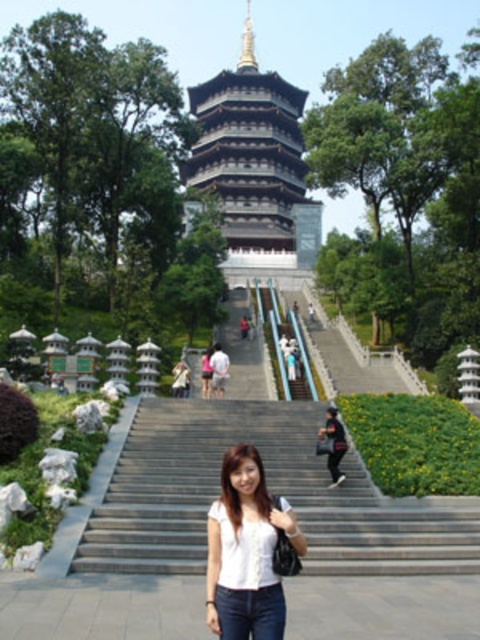
Question: Observing the image, what is the correct spatial positioning of gray concrete stairs at center in reference to white stone pagoda at center?

Choices:
 (A) below
 (B) above

Answer: (A)

Question: From the image, what is the correct spatial relationship of gray concrete stairs at center in relation to white matte shirt at center?

Choices:
 (A) below
 (B) above

Answer: (A)

Question: Which object is closer to the camera taking this photo?

Choices:
 (A) gray concrete stairs at center
 (B) matte black shirt at center
 (C) white stone pagoda at center
 (D) white matte shirt at center

Answer: (D)

Question: Which object appears farthest from the camera in this image?

Choices:
 (A) white matte shirt at center
 (B) gray concrete stairs at center
 (C) white stone pagoda at center
 (D) matte black shirt at center

Answer: (C)

Question: Considering the real-world distances, which object is closest to the white matte shirt at center?

Choices:
 (A) white stone pagoda at center
 (B) gray concrete stairs at center
 (C) matte black shirt at center

Answer: (B)

Question: Does white stone pagoda at center appear under matte black shirt at center?

Choices:
 (A) yes
 (B) no

Answer: (B)